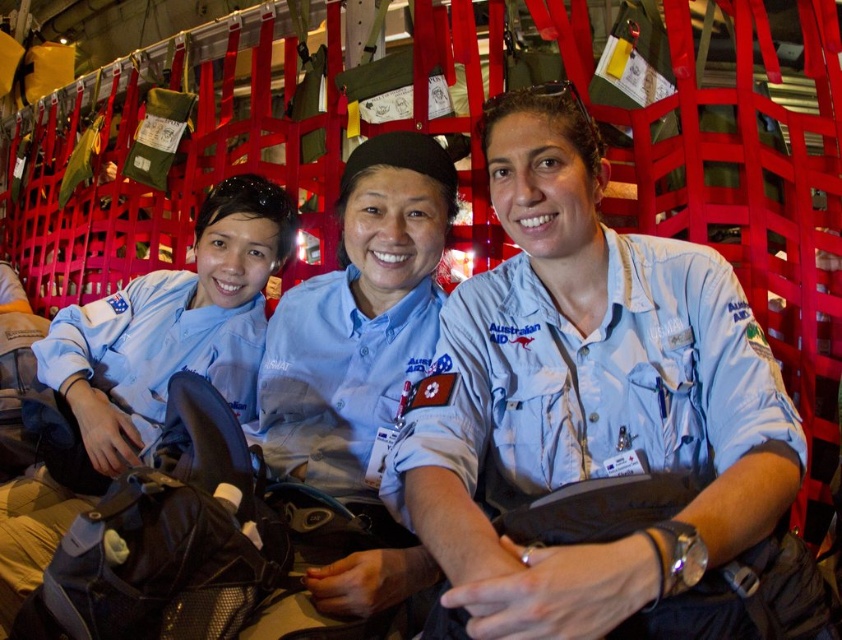
You are a photographer trying to capture the middle person in this image. You notice two shirts on them labeled as light blue fabric shirt at center and blue uniform shirt at center. Which shirt should you focus on to ensure the subject is clearly visible in your photo?

The light blue fabric shirt at center is located below the blue uniform shirt at center, so focusing on the blue uniform shirt at center would ensure the subject is clearly visible as it is positioned higher up.

You are an observer looking at the image of three people in an aircraft cargo hold. You notice two shirts at the center labeled as light blue fabric shirt at center and blue uniform shirt at center. Which one is shorter in height?

The light blue fabric shirt at center is shorter in height compared to the blue uniform shirt at center.